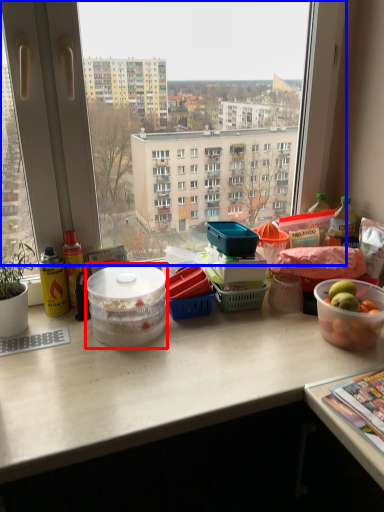
Question: Which of the following is the closest to the observer, bowl (highlighted by a red box) or window (highlighted by a blue box)?

Choices:
 (A) bowl
 (B) window

Answer: (B)